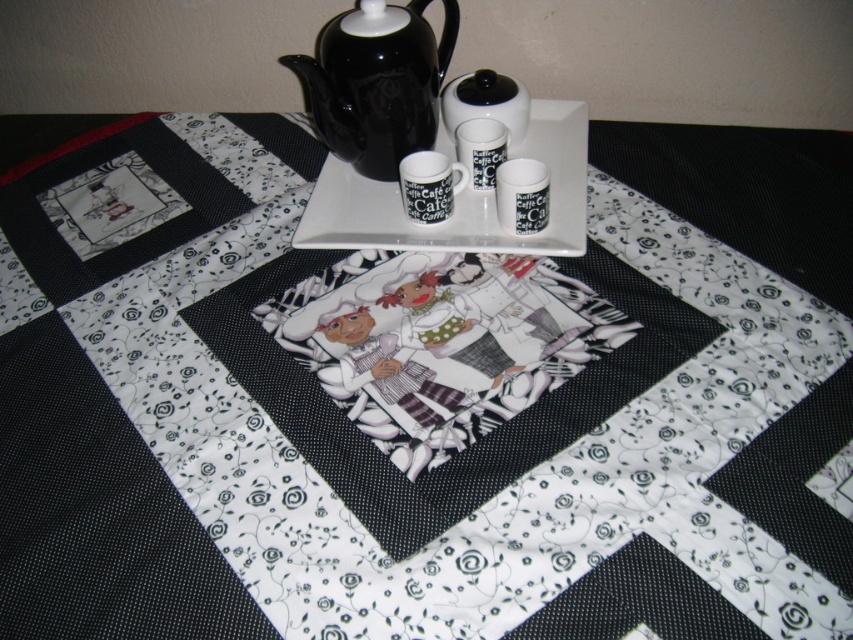
You are setting up a tea service on the table and need to place the black ceramic teapot at upper center and the white glossy platter at upper center. Which item should you place first if you want to ensure the taller item is placed before the shorter one?

You should place the black ceramic teapot at upper center first because it has a greater height compared to the white glossy platter at upper center.

Please provide the coordinates of the black ceramic teapot at upper center.

The black ceramic teapot at upper center is located at coordinates point (x=376, y=83).